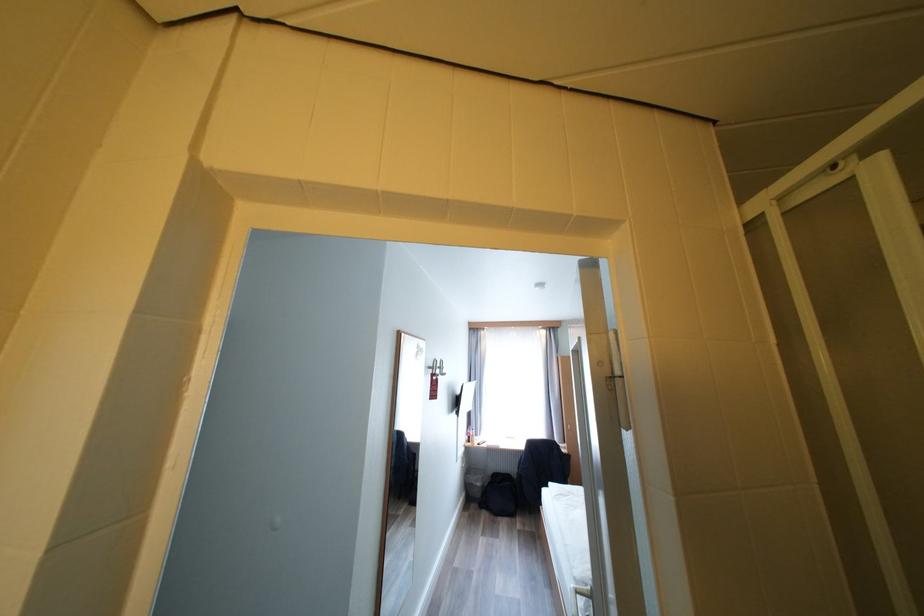
This screenshot has width=924, height=616. What do you see at coordinates (438, 367) in the screenshot? I see `a silver coat hook` at bounding box center [438, 367].